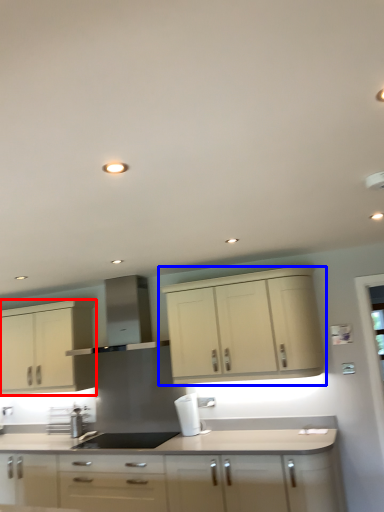
Question: Which object appears farthest to the camera in this image, cabinetry (highlighted by a red box) or cabinetry (highlighted by a blue box)?

Choices:
 (A) cabinetry
 (B) cabinetry

Answer: (A)